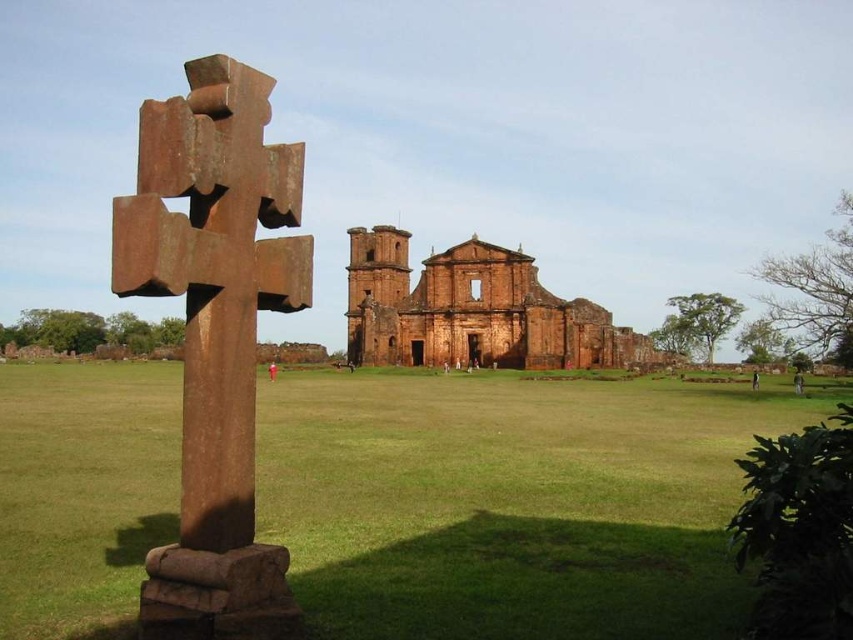
Question: Which point appears farthest from the camera in this image?

Choices:
 (A) (519, 412)
 (B) (199, 97)

Answer: (A)

Question: Is rusty metal cross at left above brown brick ruins at center?

Choices:
 (A) yes
 (B) no

Answer: (B)

Question: Does green grass at center have a larger size compared to brown brick ruins at center?

Choices:
 (A) no
 (B) yes

Answer: (B)

Question: Which of the following is the closest to the observer?

Choices:
 (A) (454, 316)
 (B) (119, 280)
 (C) (483, 403)

Answer: (B)

Question: Does green grass at center have a lesser width compared to rusty metal cross at left?

Choices:
 (A) yes
 (B) no

Answer: (B)

Question: Which object is positioned farthest from the rusty metal cross at left?

Choices:
 (A) brown brick ruins at center
 (B) green grass at center

Answer: (A)